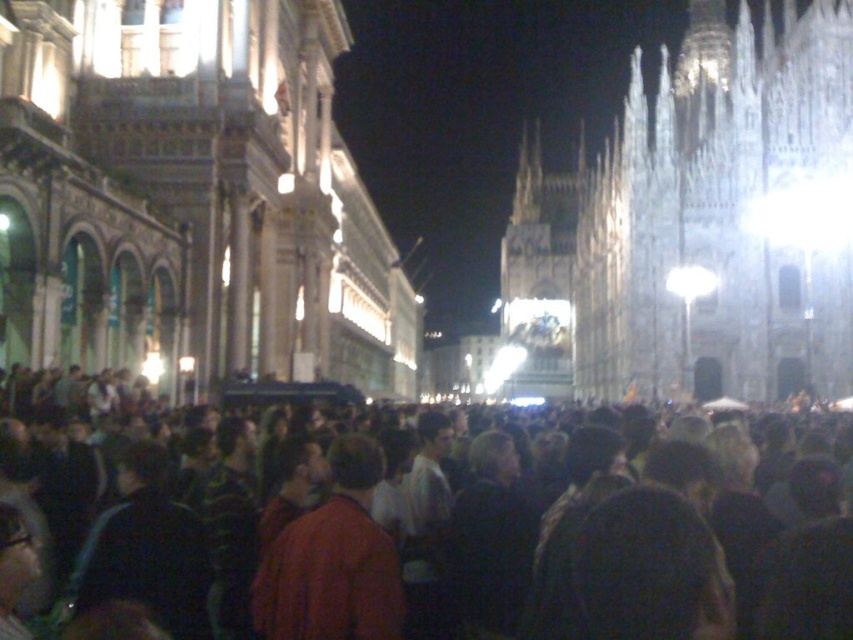
Who is more distant from viewer, (154, 8) or (334, 444)?

Positioned behind is point (154, 8).

Can you confirm if stone church at center is smaller than red matte jacket at center?

No.

Between point (335, 221) and point (361, 524), which one is positioned behind?

The point (335, 221) is behind.

Where is `stone church at center`? This screenshot has height=640, width=853. stone church at center is located at coordinates (190, 195).

Does dark matte crowd at center appear under red matte jacket at center?

No.

Looking at this image, is the position of dark matte crowd at center less distant than that of red matte jacket at center?

Yes, it is in front of red matte jacket at center.

Is point (492, 458) less distant than point (258, 582)?

No, (492, 458) is further to viewer.

You are a GUI agent. You are given a task and a screenshot of the screen. Output one action in this format:
    pyautogui.click(x=<x>, y=<y>)
    Task: Click on the dark matte crowd at center
    This screenshot has height=640, width=853.
    Given the screenshot: What is the action you would take?
    point(654,548)

Is dark matte crowd at center positioned behind white stone church at upper right?

No, it is in front of white stone church at upper right.

Who is shorter, dark matte crowd at center or white stone church at upper right?

With less height is dark matte crowd at center.

Does point (726, 436) come behind point (845, 48)?

No, (726, 436) is closer to viewer.

At what (x,y) coordinates should I click in order to perform the action: click on dark matte crowd at center. Please return your answer as a coordinate pair (x, y). Looking at the image, I should click on (654, 548).